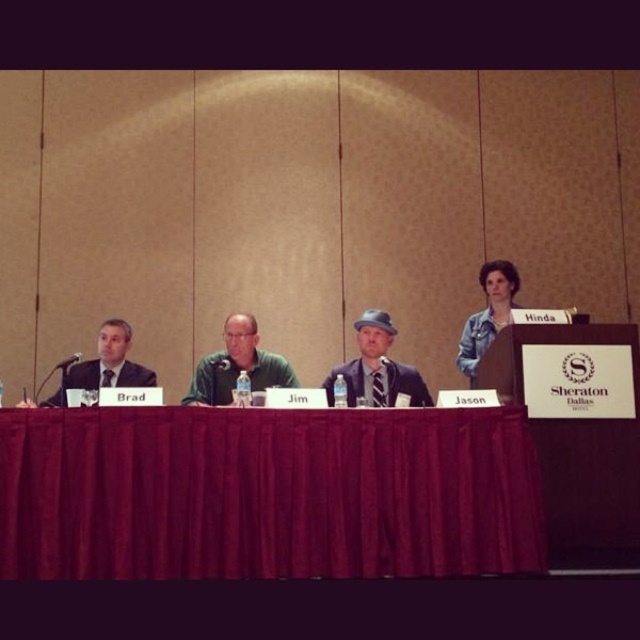
Does point (147, 557) come closer to viewer compared to point (326, 396)?

Yes, point (147, 557) is in front of point (326, 396).

Is point (413, 429) farther from camera compared to point (422, 392)?

No, it is not.

Identify the location of velvet red table at center. (266, 493).

Does green matte shirt at center have a larger size compared to matte black suit at left?

No, green matte shirt at center is not bigger than matte black suit at left.

Who is higher up, green matte shirt at center or matte black suit at left?

green matte shirt at center is higher up.

Who is more distant from viewer, (237, 371) or (116, 371)?

The point (116, 371) is more distant.

Where is `green matte shirt at center`? This screenshot has width=640, height=640. green matte shirt at center is located at coordinates (237, 365).

Describe the element at coordinates (376, 369) in the screenshot. I see `matte black suit at center` at that location.

Who is more distant from viewer, (372, 380) or (492, 294)?

The point (492, 294) is more distant.

This screenshot has height=640, width=640. I want to click on matte black suit at center, so click(376, 369).